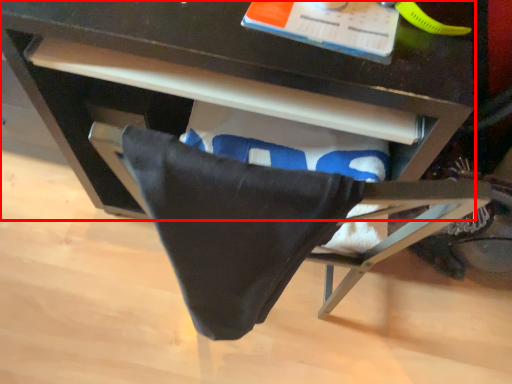
Question: In this image, where is desk (annotated by the red box) located relative to blanket?

Choices:
 (A) left
 (B) right

Answer: (A)